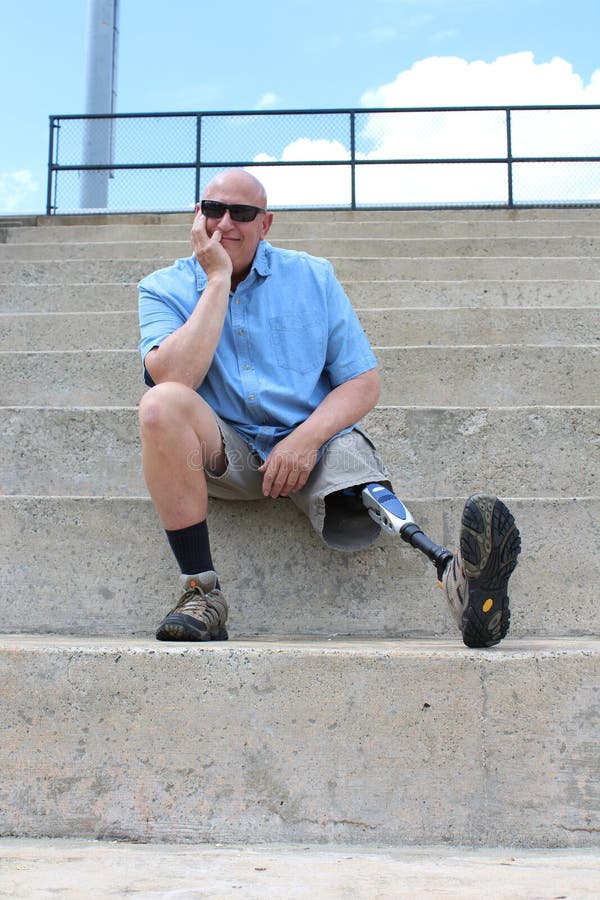
The height and width of the screenshot is (900, 600). Identify the location of steps. (58, 230), (49, 252), (49, 274), (46, 294), (42, 328), (40, 372), (43, 451), (43, 543), (46, 691).